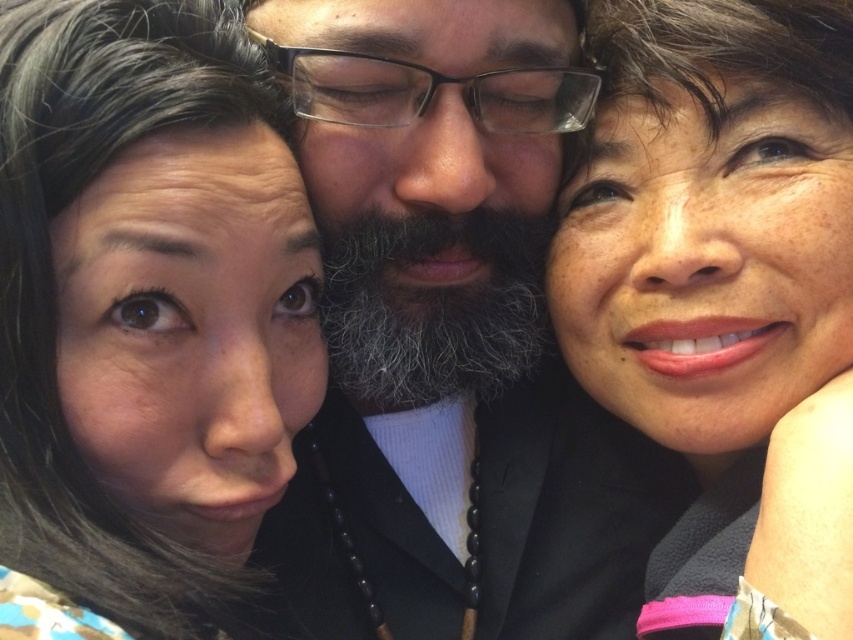
Question: Is smooth black beard at center above smooth skin face at upper right?

Choices:
 (A) no
 (B) yes

Answer: (A)

Question: Based on their relative distances, which object is nearer to the smooth skin face at upper left?

Choices:
 (A) gray/white/fuzzy beard at center
 (B) smooth black beard at center

Answer: (B)

Question: Which object is the farthest from the smooth black beard at center?

Choices:
 (A) smooth skin face at upper left
 (B) gray/white/fuzzy beard at center
 (C) smooth skin face at upper right

Answer: (A)

Question: Is smooth black beard at center to the left of smooth skin face at upper right from the viewer's perspective?

Choices:
 (A) no
 (B) yes

Answer: (B)

Question: Can you confirm if smooth skin face at upper left is bigger than gray/white/fuzzy beard at center?

Choices:
 (A) yes
 (B) no

Answer: (A)

Question: Which of the following is the farthest from the observer?

Choices:
 (A) smooth skin face at upper left
 (B) smooth black beard at center
 (C) gray/white/fuzzy beard at center
 (D) smooth skin face at upper right

Answer: (C)